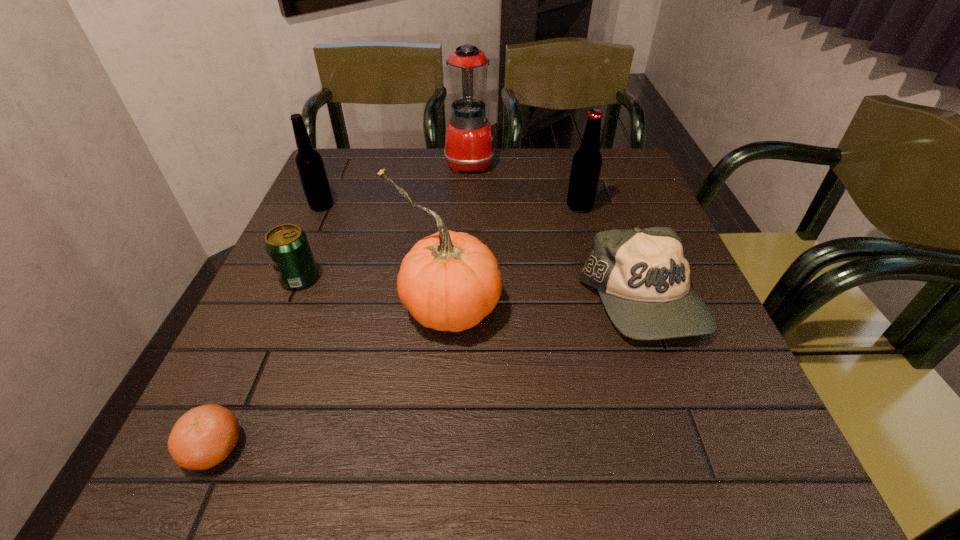
The width and height of the screenshot is (960, 540). I want to click on blank space located on the front of the right beer bottle, so 610,314.

At what (x,y) coordinates should I click in order to perform the action: click on vacant region located on the right of the left beer bottle. Please return your answer as a coordinate pair (x, y). Image resolution: width=960 pixels, height=540 pixels. Looking at the image, I should click on (415, 205).

Where is `free space located 0.320m on the back of the beer can`? The width and height of the screenshot is (960, 540). free space located 0.320m on the back of the beer can is located at coordinates (340, 184).

Find the location of a particular element. Image resolution: width=960 pixels, height=540 pixels. free space located 0.050m on the front-facing side of the baseball cap is located at coordinates (669, 377).

You are a GUI agent. You are given a task and a screenshot of the screen. Output one action in this format:
    pyautogui.click(x=<x>, y=<y>)
    Task: Click on the free space located 0.050m on the right of the nearest object
    The width and height of the screenshot is (960, 540).
    Given the screenshot: What is the action you would take?
    (x=278, y=448)

The width and height of the screenshot is (960, 540). What are the coordinates of `object located at the far edge` in the screenshot? It's located at click(469, 146).

You are a GUI agent. You are given a task and a screenshot of the screen. Output one action in this format:
    pyautogui.click(x=<x>, y=<y>)
    Task: Click on the object that is at the near edge
    
    Given the screenshot: What is the action you would take?
    pyautogui.click(x=204, y=436)

Where is `beer bottle that is at the left edge`? The width and height of the screenshot is (960, 540). beer bottle that is at the left edge is located at coordinates (x=309, y=163).

Identify the location of beer can that is at the left edge. (287, 246).

Locate an element on the screen. This screenshot has height=540, width=960. clementine at the left edge is located at coordinates (204, 436).